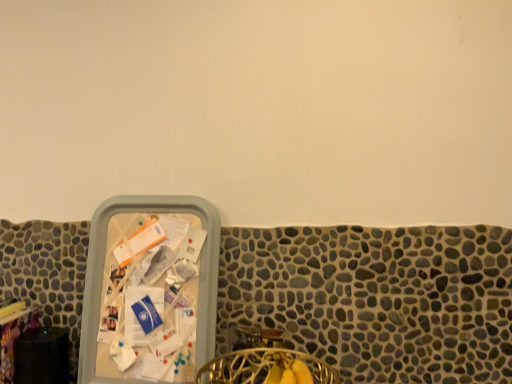
Question: Does wooden table at lower left have a larger size compared to gold wire basket at lower center?

Choices:
 (A) yes
 (B) no

Answer: (B)

Question: Can you confirm if wooden table at lower left is thinner than gold wire basket at lower center?

Choices:
 (A) no
 (B) yes

Answer: (B)

Question: Are wooden table at lower left and gold wire basket at lower center beside each other?

Choices:
 (A) yes
 (B) no

Answer: (B)

Question: Is wooden table at lower left positioned with its back to gold wire basket at lower center?

Choices:
 (A) no
 (B) yes

Answer: (A)

Question: Considering the relative positions of wooden table at lower left and gold wire basket at lower center in the image provided, is wooden table at lower left behind gold wire basket at lower center?

Choices:
 (A) no
 (B) yes

Answer: (B)

Question: Is wooden table at lower left to the right of gold wire basket at lower center from the viewer's perspective?

Choices:
 (A) no
 (B) yes

Answer: (A)

Question: Could you tell me if gold wire basket at lower center is turned towards wooden table at lower left?

Choices:
 (A) no
 (B) yes

Answer: (A)

Question: Considering the relative sizes of gold wire basket at lower center and wooden table at lower left in the image provided, is gold wire basket at lower center thinner than wooden table at lower left?

Choices:
 (A) yes
 (B) no

Answer: (B)

Question: Considering the relative sizes of gold wire basket at lower center and wooden table at lower left in the image provided, is gold wire basket at lower center shorter than wooden table at lower left?

Choices:
 (A) no
 (B) yes

Answer: (B)

Question: From the image's perspective, is gold wire basket at lower center beneath wooden table at lower left?

Choices:
 (A) yes
 (B) no

Answer: (A)

Question: Is gold wire basket at lower center bigger than wooden table at lower left?

Choices:
 (A) no
 (B) yes

Answer: (B)

Question: Does gold wire basket at lower center appear on the left side of wooden table at lower left?

Choices:
 (A) yes
 (B) no

Answer: (B)

Question: In terms of size, does wooden table at lower left appear bigger or smaller than gold wire basket at lower center?

Choices:
 (A) big
 (B) small

Answer: (B)